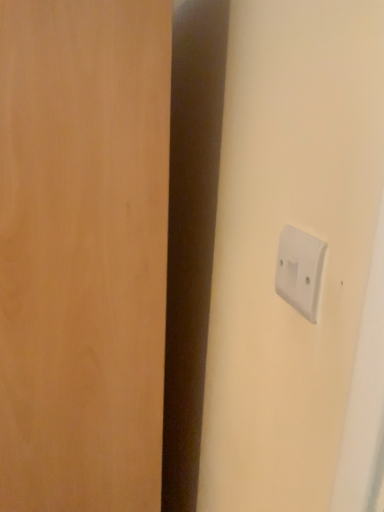
Where is `matte wood door at center`? The image size is (384, 512). matte wood door at center is located at coordinates (83, 252).

The width and height of the screenshot is (384, 512). What do you see at coordinates (83, 252) in the screenshot? I see `matte wood door at center` at bounding box center [83, 252].

In order to face matte wood door at center, should I rotate leftwards or rightwards?

Turn left approximately 16.289 degrees to face it.

Where is `matte wood door at center`? The width and height of the screenshot is (384, 512). matte wood door at center is located at coordinates (83, 252).